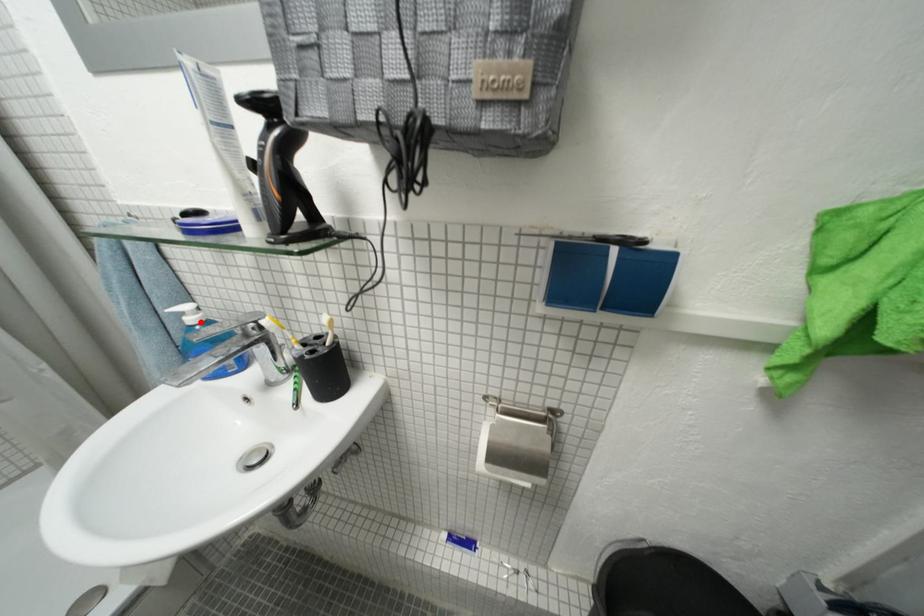
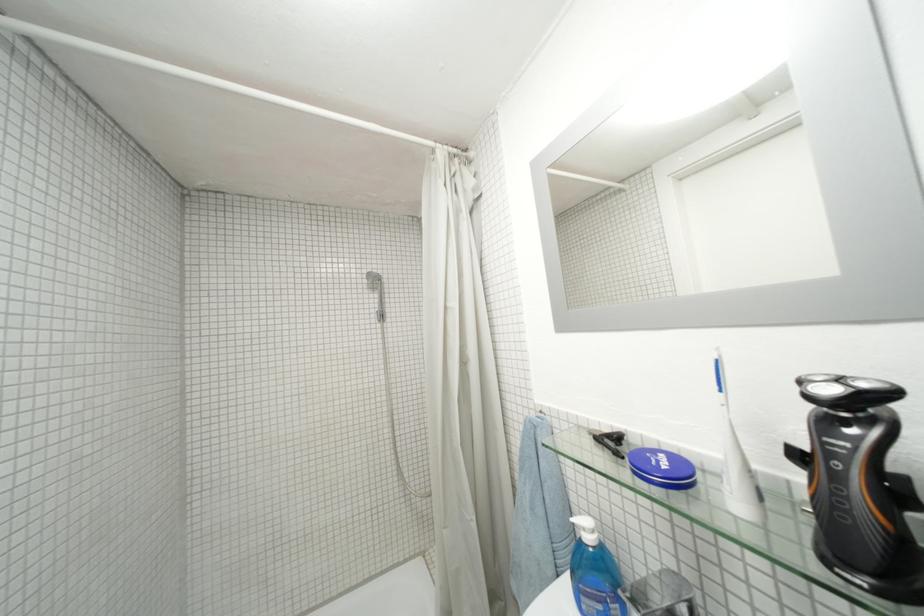
Where in the second image is the point corresponding to the highlighted location from the first image?

(598, 541)